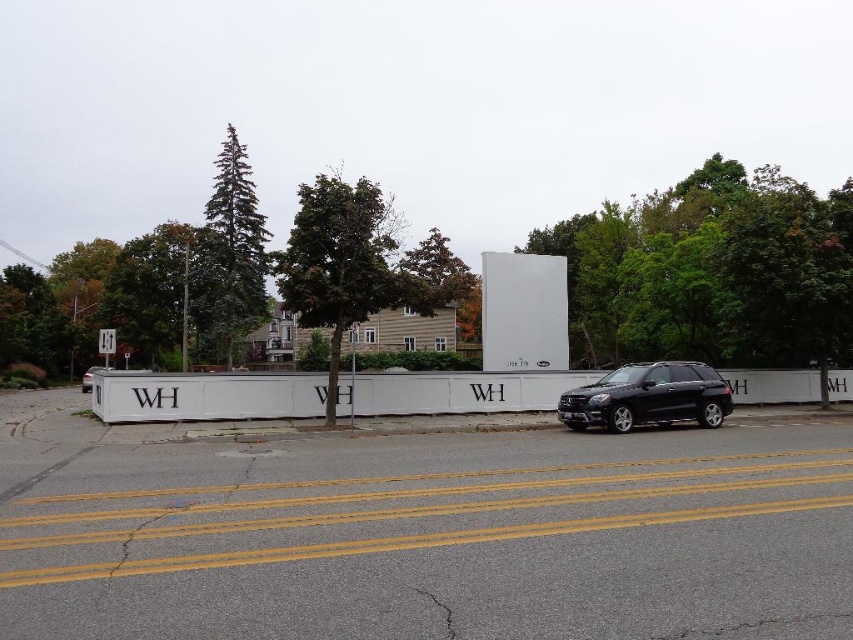
You are standing at the point labeled as point (344, 264) in the image. What object are you facing?

The point labeled as point (344, 264) corresponds to the green leafy tree at center, so you are facing the green leafy tree at center.

You are a pedestrian crossing the street. You see a green leafy tree at center and a black matte suv at center. Which object is closer to you?

The green leafy tree at center is closer to you because the black matte suv at center is behind it.